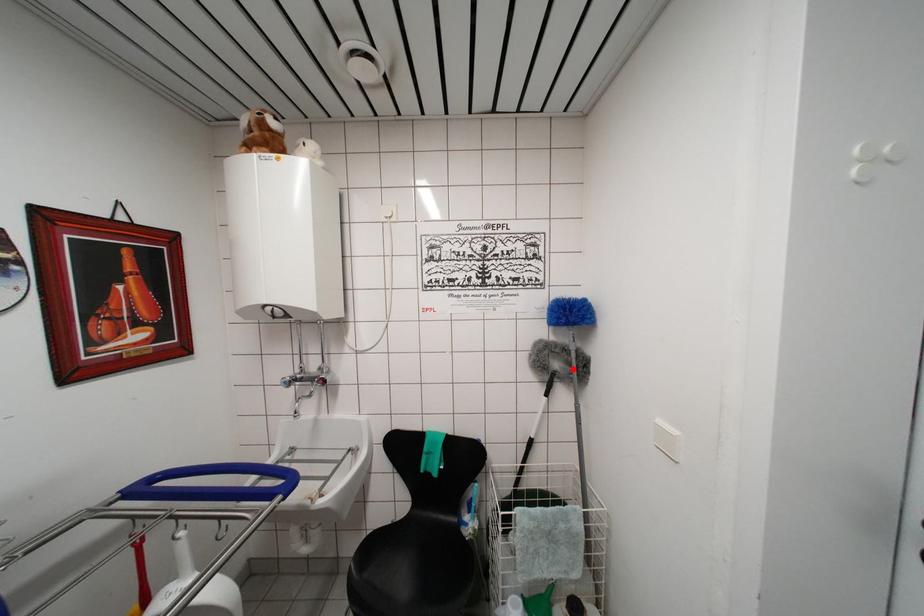
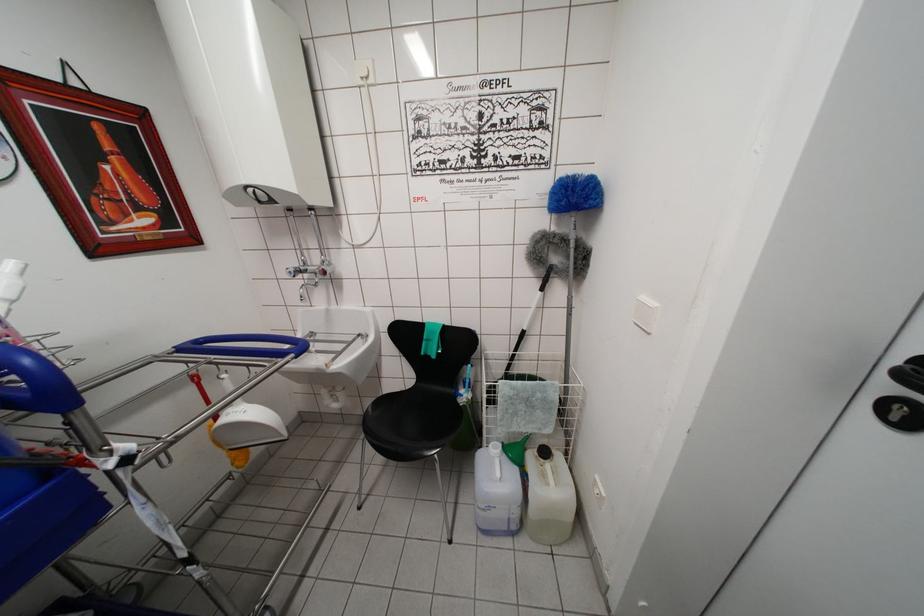
In the second image, find the point that corresponds to the highlighted location in the first image.

(572, 261)